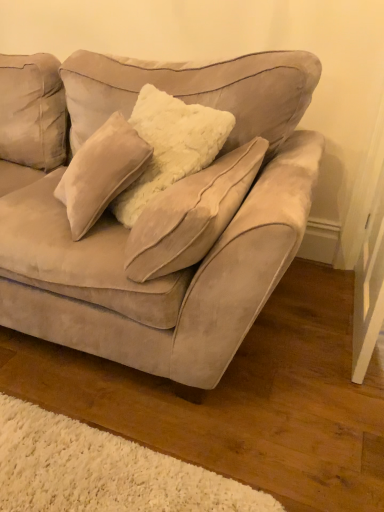
At what (x,y) coordinates should I click in order to perform the action: click on suede couch at center. Please return your answer as a coordinate pair (x, y). Looking at the image, I should click on (128, 231).

The width and height of the screenshot is (384, 512). Describe the element at coordinates (128, 231) in the screenshot. I see `suede couch at center` at that location.

Describe the element at coordinates (101, 172) in the screenshot. I see `suede beige pillow at center` at that location.

The image size is (384, 512). What are the coordinates of `suede beige pillow at center` in the screenshot? It's located at (101, 172).

Identify the location of suede couch at center. This screenshot has height=512, width=384. (128, 231).

Considering the relative positions of suede beige pillow at center and suede couch at center in the image provided, is suede beige pillow at center to the left of suede couch at center from the viewer's perspective?

Incorrect, suede beige pillow at center is not on the left side of suede couch at center.

From the picture: Does suede beige pillow at center come behind suede couch at center?

Yes, suede beige pillow at center is behind suede couch at center.

Is point (58, 198) less distant than point (281, 143)?

Yes, it is in front of point (281, 143).

From the image's perspective, relative to suede couch at center, is suede beige pillow at center above or below?

Based on their image positions, suede beige pillow at center is located beneath suede couch at center.

From a real-world perspective, who is located lower, suede beige pillow at center or suede couch at center?

From a 3D spatial view, suede couch at center is below.

Considering the sizes of suede beige pillow at center and suede couch at center in the image, is suede beige pillow at center wider or thinner than suede couch at center?

Considering their sizes, suede beige pillow at center looks slimmer than suede couch at center.

Is suede beige pillow at center shorter than suede couch at center?

Yes.

Considering the relative sizes of suede beige pillow at center and suede couch at center in the image provided, is suede beige pillow at center smaller than suede couch at center?

Yes, suede beige pillow at center is smaller than suede couch at center.

Is suede beige pillow at center inside or outside of suede couch at center?

suede beige pillow at center lies within the bounds of suede couch at center.

Is suede beige pillow at center touching suede couch at center?

No.

From the picture: Is suede beige pillow at center oriented away from suede couch at center?

Yes, suede beige pillow at center is facing away from suede couch at center.

How different are the orientations of suede beige pillow at center and suede couch at center in degrees?

The angle between the facing direction of suede beige pillow at center and the facing direction of suede couch at center is 48.5 degrees.

Measure the distance from suede beige pillow at center to suede couch at center.

suede beige pillow at center and suede couch at center are 26.20 centimeters apart from each other.

In the image, there is a suede couch at center. At what (x,y) coordinates should I click in order to perform the action: click on pillow below it (from the image's perspective). Please return your answer as a coordinate pair (x, y). This screenshot has height=512, width=384. Looking at the image, I should click on (101, 172).

In the image, is suede couch at center on the left side or the right side of suede beige pillow at center?

suede couch at center is to the left of suede beige pillow at center.

Does suede couch at center lie behind suede beige pillow at center?

No, it is not.

Which is less distant, (195,85) or (95,174)?

Point (195,85) is farther from the camera than point (95,174).

From the image's perspective, which is below, suede couch at center or suede beige pillow at center?

From the image's view, suede beige pillow at center is below.

From a real-world perspective, is suede couch at center physically below suede beige pillow at center?

Yes, from a real-world perspective, suede couch at center is beneath suede beige pillow at center.

In terms of width, does suede couch at center look wider or thinner when compared to suede beige pillow at center?

Considering their sizes, suede couch at center looks broader than suede beige pillow at center.

In terms of height, does suede couch at center look taller or shorter compared to suede beige pillow at center?

suede couch at center is taller than suede beige pillow at center.

Does suede couch at center have a larger size compared to suede beige pillow at center?

Correct, suede couch at center is larger in size than suede beige pillow at center.

Is suede couch at center outside of suede beige pillow at center?

Yes, suede couch at center is outside of suede beige pillow at center.

Would you say suede couch at center is a long distance from suede beige pillow at center?

No, suede couch at center is not far from suede beige pillow at center.

Is suede couch at center positioned with its back to suede beige pillow at center?

Absolutely, suede couch at center is directed away from suede beige pillow at center.

Can you tell me how much suede couch at center and suede beige pillow at center differ in facing direction?

suede couch at center and suede beige pillow at center are facing 48.5 degrees away from each other.

You are a GUI agent. You are given a task and a screenshot of the screen. Output one action in this format:
    pyautogui.click(x=<x>, y=<y>)
    Task: Click on the pillow above the suede couch at center (from a real-world perspective)
    
    Given the screenshot: What is the action you would take?
    pyautogui.click(x=101, y=172)

Image resolution: width=384 pixels, height=512 pixels. Find the location of `studio couch on the left of suede beige pillow at center`. studio couch on the left of suede beige pillow at center is located at coordinates (128, 231).

At what (x,y) coordinates should I click in order to perform the action: click on pillow lying on the right of suede couch at center. Please return your answer as a coordinate pair (x, y). Looking at the image, I should click on (101, 172).